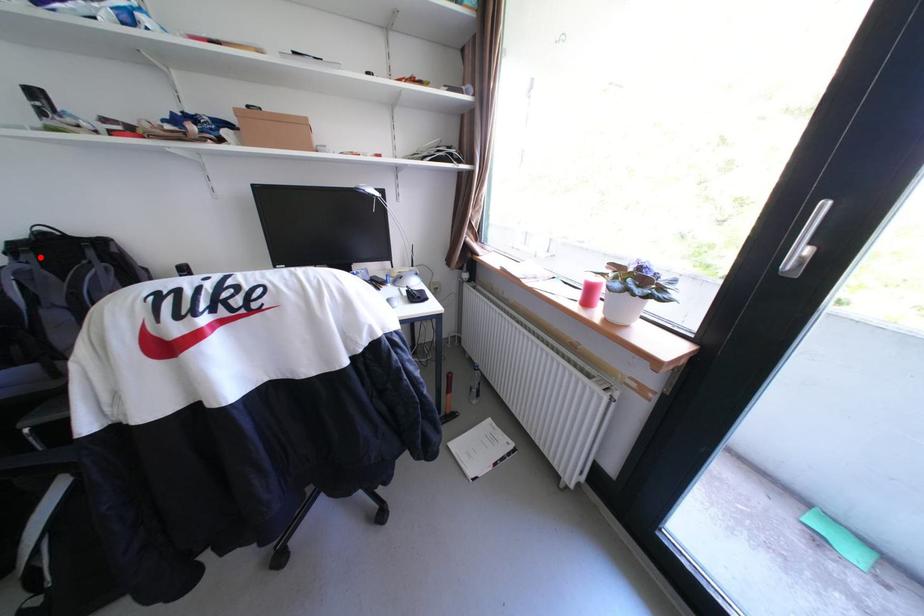
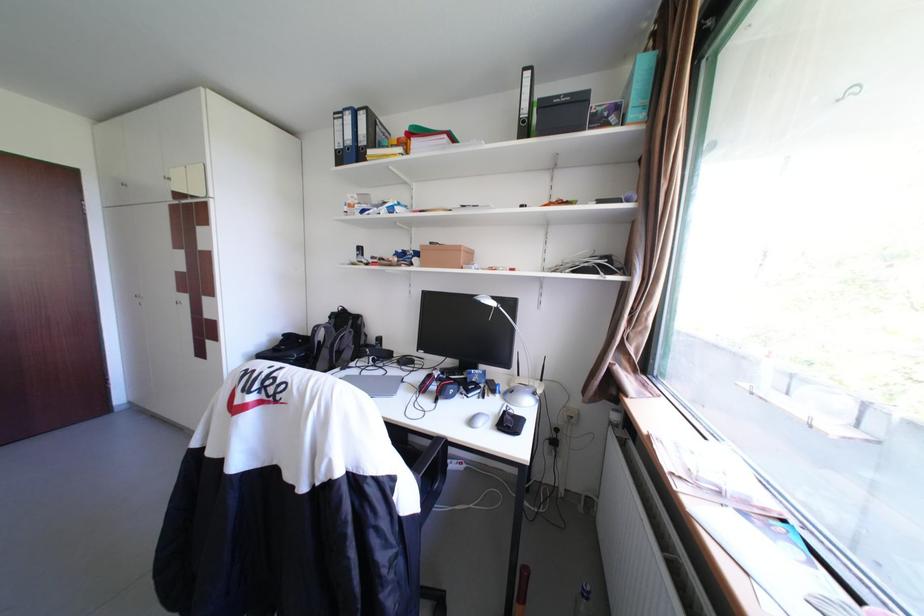
In the second image, find the point that corresponds to the highlighted location in the first image.

(344, 321)